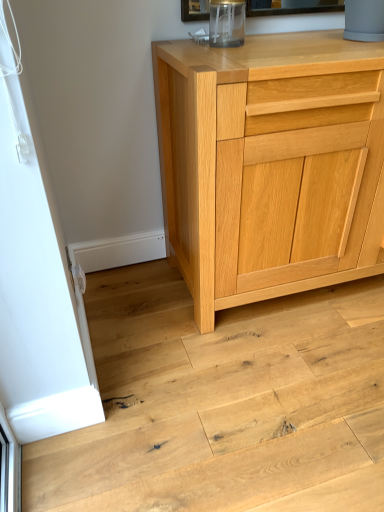
Question: Is natural wood floor at lower left further to camera compared to natural wood cabinet at center?

Choices:
 (A) no
 (B) yes

Answer: (A)

Question: From a real-world perspective, is natural wood floor at lower left over natural wood cabinet at center?

Choices:
 (A) no
 (B) yes

Answer: (A)

Question: Are natural wood floor at lower left and natural wood cabinet at center beside each other?

Choices:
 (A) no
 (B) yes

Answer: (A)

Question: Can you confirm if natural wood floor at lower left is smaller than natural wood cabinet at center?

Choices:
 (A) yes
 (B) no

Answer: (A)

Question: Can you confirm if natural wood floor at lower left is thinner than natural wood cabinet at center?

Choices:
 (A) yes
 (B) no

Answer: (B)

Question: Can you confirm if natural wood floor at lower left is positioned to the left of natural wood cabinet at center?

Choices:
 (A) yes
 (B) no

Answer: (A)

Question: From the image's perspective, is natural wood cabinet at center on natural wood floor at lower left?

Choices:
 (A) yes
 (B) no

Answer: (A)

Question: Is natural wood cabinet at center taller than natural wood floor at lower left?

Choices:
 (A) no
 (B) yes

Answer: (B)

Question: Could natural wood floor at lower left be considered to be inside natural wood cabinet at center?

Choices:
 (A) yes
 (B) no

Answer: (B)

Question: Is natural wood cabinet at center looking in the opposite direction of natural wood floor at lower left?

Choices:
 (A) yes
 (B) no

Answer: (B)

Question: Considering the relative sizes of natural wood cabinet at center and natural wood floor at lower left in the image provided, is natural wood cabinet at center thinner than natural wood floor at lower left?

Choices:
 (A) no
 (B) yes

Answer: (B)

Question: From the image's perspective, is natural wood cabinet at center located beneath natural wood floor at lower left?

Choices:
 (A) no
 (B) yes

Answer: (A)

Question: From the image's perspective, relative to natural wood cabinet at center, is natural wood floor at lower left above or below?

Choices:
 (A) below
 (B) above

Answer: (A)